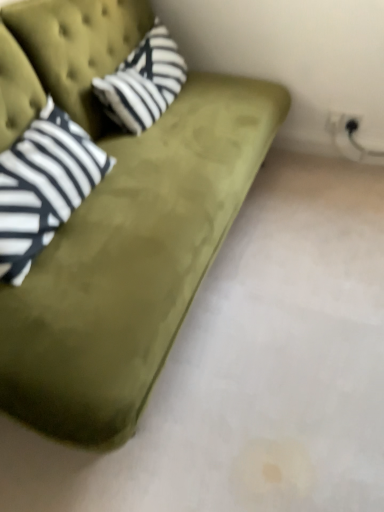
This screenshot has height=512, width=384. Describe the element at coordinates (123, 226) in the screenshot. I see `olive green velvet couch at upper left` at that location.

From the picture: In order to face striped cotton pillow at upper left, should I rotate leftwards or rightwards?

To face it directly, rotate left by 5.939 degrees.

What is the approximate height of striped fabric pillow at left?

It is 42.49 centimeters.

Where is `olive green velvet couch at upper left`? Image resolution: width=384 pixels, height=512 pixels. olive green velvet couch at upper left is located at coordinates (123, 226).

Considering the positions of objects striped cotton pillow at upper left and olive green velvet couch at upper left in the image provided, who is more to the right, striped cotton pillow at upper left or olive green velvet couch at upper left?

striped cotton pillow at upper left.

From a real-world perspective, between striped cotton pillow at upper left and olive green velvet couch at upper left, who is vertically higher?

From a 3D spatial view, striped cotton pillow at upper left is above.

Can we say striped cotton pillow at upper left lies outside olive green velvet couch at upper left?

No, striped cotton pillow at upper left is not outside of olive green velvet couch at upper left.

Considering the relative sizes of striped cotton pillow at upper left and olive green velvet couch at upper left in the image provided, is striped cotton pillow at upper left wider than olive green velvet couch at upper left?

In fact, striped cotton pillow at upper left might be narrower than olive green velvet couch at upper left.

Which is in front, point (50, 136) or point (139, 65)?

Positioned in front is point (50, 136).

From a real-world perspective, is striped fabric pillow at left physically located above or below striped cotton pillow at upper left?

Clearly, from a real-world perspective, striped fabric pillow at left is above striped cotton pillow at upper left.

Is striped fabric pillow at left facing away from striped cotton pillow at upper left?

striped fabric pillow at left does not have its back to striped cotton pillow at upper left.

Is there a large distance between striped fabric pillow at left and striped cotton pillow at upper left?

Actually, striped fabric pillow at left and striped cotton pillow at upper left are a little close together.

Considering the sizes of objects striped cotton pillow at upper left and striped fabric pillow at left in the image provided, who is taller, striped cotton pillow at upper left or striped fabric pillow at left?

With more height is striped fabric pillow at left.

Between striped cotton pillow at upper left and striped fabric pillow at left, which one has smaller size?

With smaller size is striped cotton pillow at upper left.

Is there a large distance between striped cotton pillow at upper left and striped fabric pillow at left?

Actually, striped cotton pillow at upper left and striped fabric pillow at left are a little close together.

Is point (151, 39) more distant than point (16, 184)?

Yes, point (151, 39) is behind point (16, 184).

Considering the positions of objects striped fabric pillow at left and olive green velvet couch at upper left in the image provided, who is more to the left, striped fabric pillow at left or olive green velvet couch at upper left?

From the viewer's perspective, striped fabric pillow at left appears more on the left side.

Are striped fabric pillow at left and olive green velvet couch at upper left far apart?

striped fabric pillow at left is actually quite close to olive green velvet couch at upper left.

Is point (42, 170) positioned behind point (158, 134)?

That is False.

Which object is further away from the camera, olive green velvet couch at upper left or striped fabric pillow at left?

striped fabric pillow at left is more distant.

Can we say olive green velvet couch at upper left lies outside striped fabric pillow at left?

olive green velvet couch at upper left is positioned outside striped fabric pillow at left.

From the image's perspective, does olive green velvet couch at upper left appear lower than striped fabric pillow at left?

No, from the image's perspective, olive green velvet couch at upper left is not beneath striped fabric pillow at left.

From a real-world perspective, which is physically above, olive green velvet couch at upper left or striped fabric pillow at left?

striped fabric pillow at left, from a real-world perspective.

Is olive green velvet couch at upper left positioned far away from striped cotton pillow at upper left?

No.

Where is `throw pillow above the olive green velvet couch at upper left (from the image's perspective)`? throw pillow above the olive green velvet couch at upper left (from the image's perspective) is located at coordinates (143, 82).

From the image's perspective, is olive green velvet couch at upper left located above or below striped cotton pillow at upper left?

Clearly, from the image's perspective, olive green velvet couch at upper left is below striped cotton pillow at upper left.

Which of these two, olive green velvet couch at upper left or striped cotton pillow at upper left, is smaller?

With smaller size is striped cotton pillow at upper left.

Where is `studio couch in front of the striped cotton pillow at upper left`? The width and height of the screenshot is (384, 512). studio couch in front of the striped cotton pillow at upper left is located at coordinates (123, 226).

Locate an element on the screen. The height and width of the screenshot is (512, 384). pillow on the left of striped cotton pillow at upper left is located at coordinates (43, 186).

Which object lies further to the anchor point striped fabric pillow at left, olive green velvet couch at upper left or striped cotton pillow at upper left?

striped cotton pillow at upper left is further to striped fabric pillow at left.

Looking at this image, looking at the image, which one is located closer to olive green velvet couch at upper left, striped cotton pillow at upper left or striped fabric pillow at left?

striped fabric pillow at left is positioned closer to the anchor olive green velvet couch at upper left.

Which object lies nearer to the anchor point striped cotton pillow at upper left, striped fabric pillow at left or olive green velvet couch at upper left?

Among the two, olive green velvet couch at upper left is located nearer to striped cotton pillow at upper left.

Estimate the real-world distances between objects in this image. Which object is further from olive green velvet couch at upper left, striped fabric pillow at left or striped cotton pillow at upper left?

striped cotton pillow at upper left is positioned further to the anchor olive green velvet couch at upper left.

From the image, which object appears to be farther from striped cotton pillow at upper left, olive green velvet couch at upper left or striped fabric pillow at left?

Answer: striped fabric pillow at left is positioned further to the anchor striped cotton pillow at upper left.

When comparing their distances from striped fabric pillow at left, does striped cotton pillow at upper left or olive green velvet couch at upper left seem closer?

Among the two, olive green velvet couch at upper left is located nearer to striped fabric pillow at left.

Locate an element on the screen. The height and width of the screenshot is (512, 384). pillow between olive green velvet couch at upper left and striped cotton pillow at upper left along the z-axis is located at coordinates (43, 186).